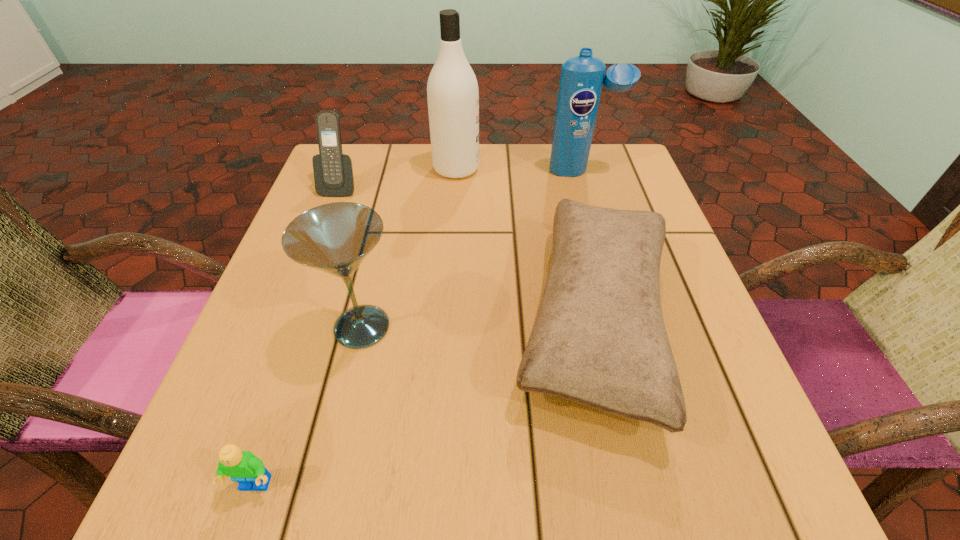
Identify the location of shampoo present at the right edge. (582, 77).

Locate an element on the screen. The width and height of the screenshot is (960, 540). cushion that is at the right edge is located at coordinates (599, 339).

Where is `object located at the far left corner`? object located at the far left corner is located at coordinates (333, 171).

Where is `object that is at the near left corner`? The width and height of the screenshot is (960, 540). object that is at the near left corner is located at coordinates (244, 467).

Where is `object that is at the far right corner`? This screenshot has height=540, width=960. object that is at the far right corner is located at coordinates (582, 77).

The width and height of the screenshot is (960, 540). Find the location of `object positioned at the near right corner`. object positioned at the near right corner is located at coordinates (599, 339).

I want to click on vacant area at the far edge of the desktop, so click(x=398, y=157).

The image size is (960, 540). In the image, there is a desktop. What are the coordinates of `vacant space at the near edge` in the screenshot? It's located at (569, 492).

The image size is (960, 540). Identify the location of vacant space at the left edge of the desktop. (295, 280).

At what (x,y) coordinates should I click in order to perform the action: click on vacant space at the right edge. Please return your answer as a coordinate pair (x, y). Looking at the image, I should click on click(x=676, y=246).